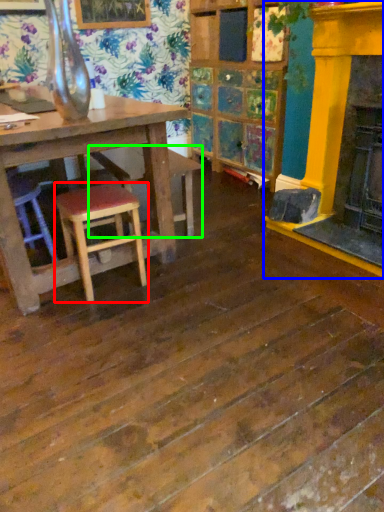
Question: Estimate the real-world distances between objects in this image. Which object is farther from stool (highlighted by a red box), fireplace (highlighted by a blue box) or bar stool (highlighted by a green box)?

Choices:
 (A) fireplace
 (B) bar stool

Answer: (A)